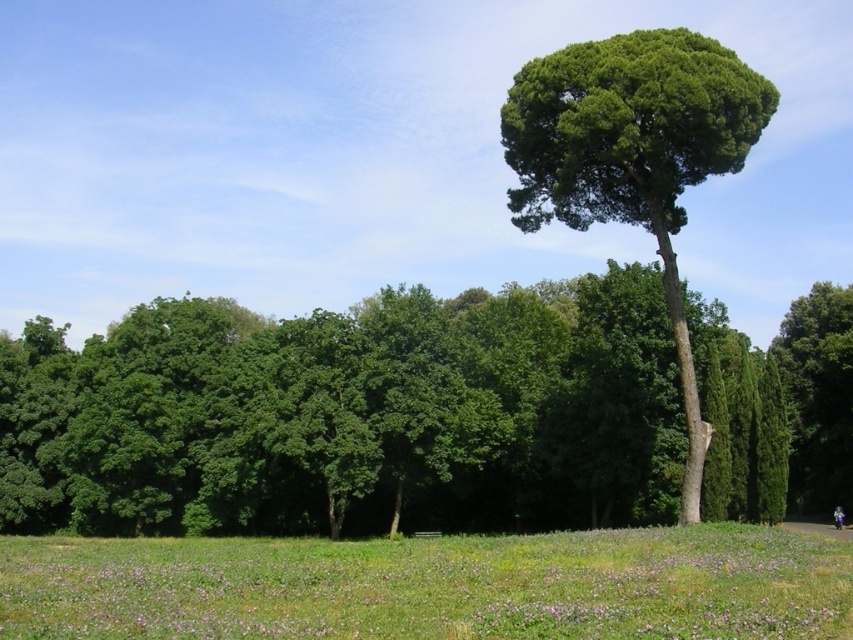
Question: Does green leafy tree at center lie behind green grass at lower center?

Choices:
 (A) yes
 (B) no

Answer: (B)

Question: Can you confirm if green grassy field at lower center is bigger than dark blue jeans at center?

Choices:
 (A) yes
 (B) no

Answer: (A)

Question: Which of the following is the closest to the observer?

Choices:
 (A) (842, 513)
 (B) (799, 417)
 (C) (316, 602)

Answer: (C)

Question: Which of the following is the closest to the observer?

Choices:
 (A) green grass at lower center
 (B) green grassy field at lower center

Answer: (B)

Question: Is the position of green leafy tree at right more distant than that of green grass at lower center?

Choices:
 (A) yes
 (B) no

Answer: (A)

Question: Which point is closer to the camera taking this photo?

Choices:
 (A) (231, 595)
 (B) (688, 157)
 (C) (838, 518)

Answer: (A)